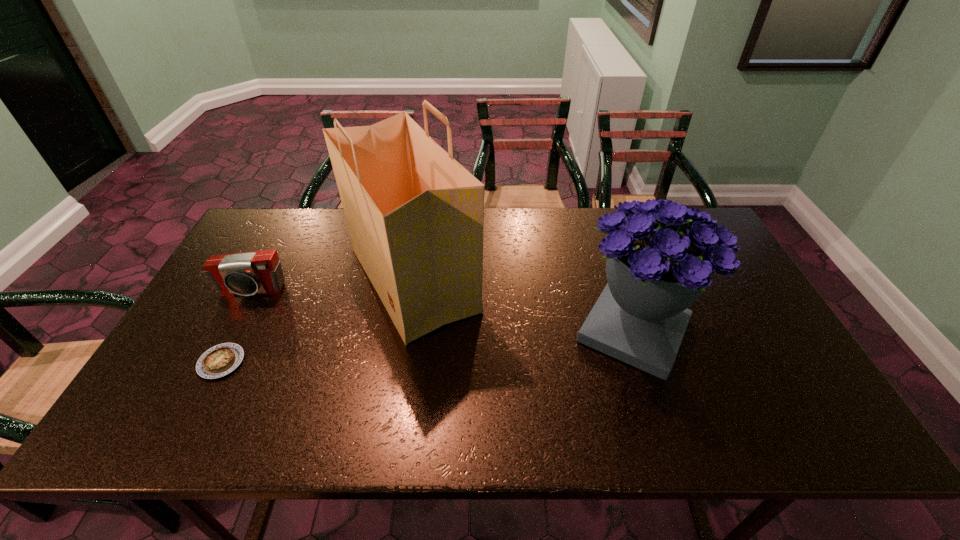
Where is `vacant space that satisfies the following two spatial constraints: 1. on the front-facing side of the shortest object; 2. on the right side of the camera`? This screenshot has height=540, width=960. vacant space that satisfies the following two spatial constraints: 1. on the front-facing side of the shortest object; 2. on the right side of the camera is located at coordinates (214, 362).

I want to click on free region that satisfies the following two spatial constraints: 1. on the front-facing side of the camera; 2. on the left side of the quiche, so click(214, 362).

Where is `vacant area in the image that satisfies the following two spatial constraints: 1. on the front-facing side of the shortest object; 2. on the right side of the camera`? Image resolution: width=960 pixels, height=540 pixels. vacant area in the image that satisfies the following two spatial constraints: 1. on the front-facing side of the shortest object; 2. on the right side of the camera is located at coordinates pyautogui.click(x=214, y=362).

This screenshot has height=540, width=960. Find the location of `free space that satisfies the following two spatial constraints: 1. on the side of the bouquet with the superhero design; 2. on the left side of the third object from left to right`. free space that satisfies the following two spatial constraints: 1. on the side of the bouquet with the superhero design; 2. on the left side of the third object from left to right is located at coordinates (404, 330).

The image size is (960, 540). Identify the location of free spot that satisfies the following two spatial constraints: 1. on the side of the grocery bag with the superhero design; 2. on the front-facing side of the second shortest object. (411, 291).

You are a GUI agent. You are given a task and a screenshot of the screen. Output one action in this format:
    pyautogui.click(x=<x>, y=<y>)
    Task: Click on the blank space that satisfies the following two spatial constraints: 1. on the side of the tallest object with the superhero design; 2. on the right side of the bouquet
    The height and width of the screenshot is (540, 960).
    Given the screenshot: What is the action you would take?
    pyautogui.click(x=404, y=330)

I want to click on vacant area in the image that satisfies the following two spatial constraints: 1. on the side of the second object from right to left with the superhero design; 2. on the right side of the bouquet, so click(x=404, y=330).